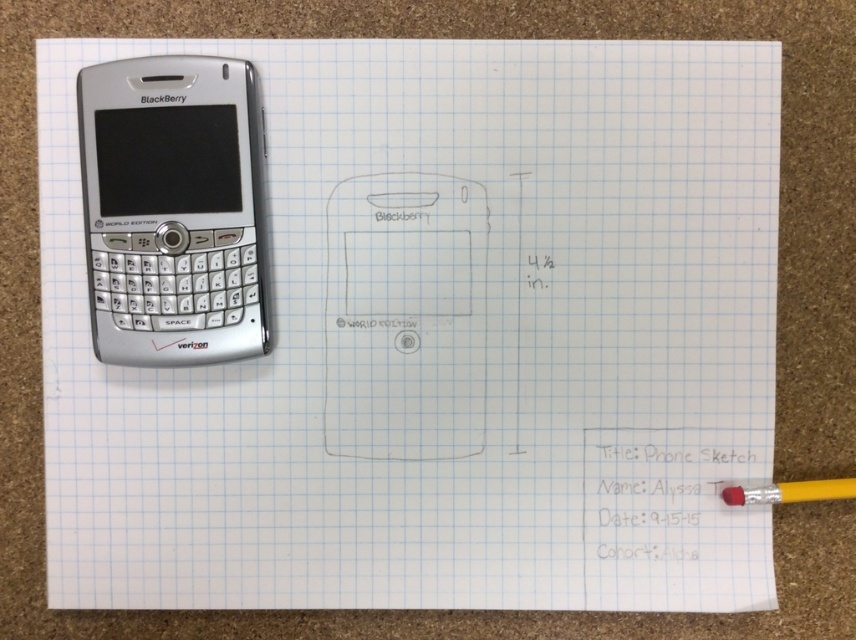
Question: Is silver metallic blackberry at upper left positioned behind rubber eraser at lower right?

Choices:
 (A) yes
 (B) no

Answer: (B)

Question: Where is silver metallic blackberry at upper left located in relation to red rubber eraser at bottom right in the image?

Choices:
 (A) left
 (B) right

Answer: (A)

Question: Which of the following is the farthest from the observer?

Choices:
 (A) (247, 77)
 (B) (791, 488)

Answer: (B)

Question: Which point appears farthest from the camera in this image?

Choices:
 (A) (727, 496)
 (B) (724, 499)

Answer: (B)

Question: Can you confirm if silver metallic blackberry at upper left is smaller than rubber eraser at lower right?

Choices:
 (A) yes
 (B) no

Answer: (B)

Question: Which object appears farthest from the camera in this image?

Choices:
 (A) silver metallic blackberry at upper left
 (B) rubber eraser at lower right
 (C) red rubber eraser at bottom right

Answer: (B)